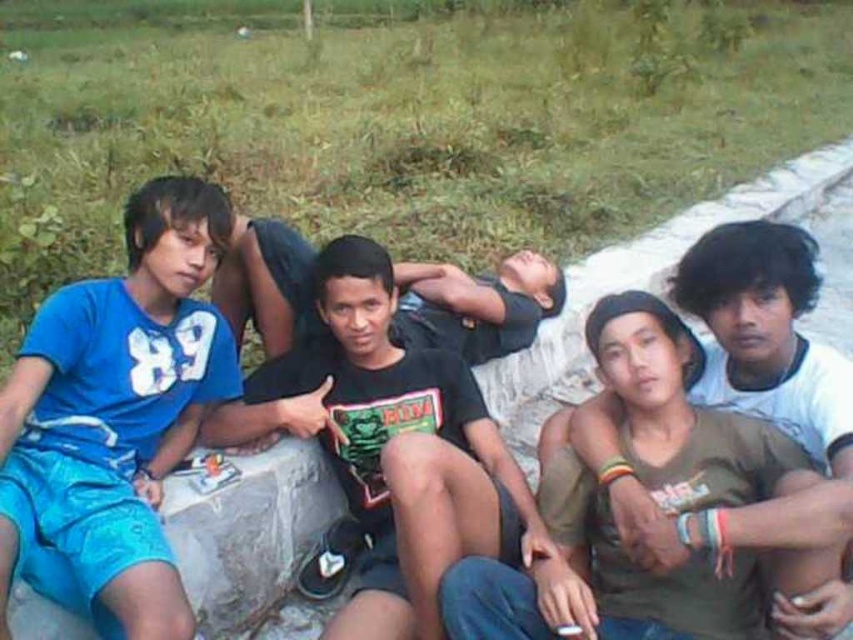
You are standing in front of the concrete ledge where the group is sitting. You want to place a small potted plant between the matte blue shorts at left and the viewer. Is there enough space to fit the plant?

The distance between the matte blue shorts at left and the viewer is 5.35 feet, so there is enough space to fit a small potted plant between them.